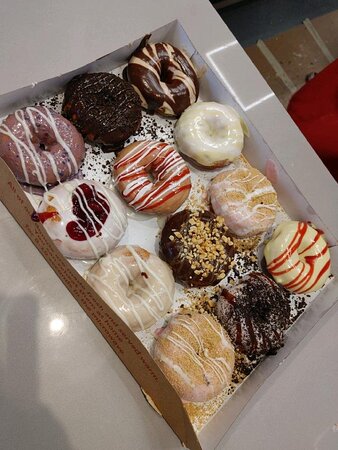
In order to click on counter in this screenshot , I will do pyautogui.click(x=56, y=360).